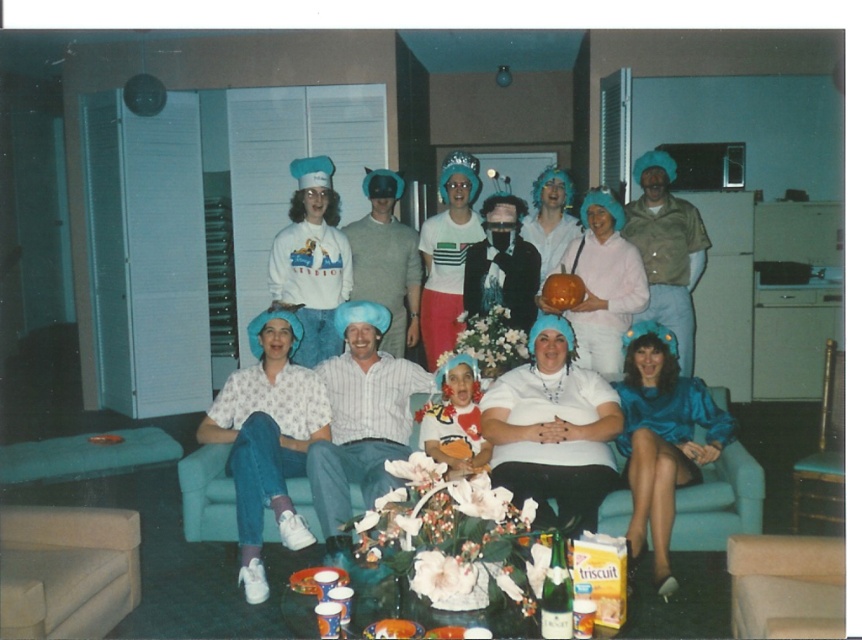
Question: Which of the following is the closest to the observer?

Choices:
 (A) blue satin dress at lower right
 (B) beige fabric couch at lower left
 (C) shiny blue dress at lower right
 (D) matte pink sweater at center

Answer: (B)

Question: Does teal fabric couch at center have a lesser width compared to velvet plush teddy bear at center?

Choices:
 (A) no
 (B) yes

Answer: (A)

Question: Can you confirm if blue satin dress at lower right is positioned to the right of white printed shirt at center?

Choices:
 (A) no
 (B) yes

Answer: (B)

Question: Which point is closer to the camera?

Choices:
 (A) (223, 440)
 (B) (417, 397)

Answer: (A)

Question: Which point is closer to the camera?

Choices:
 (A) white matte shirt at center
 (B) shiny blue dress at lower right

Answer: (A)

Question: Can you confirm if teal fabric couch at center is positioned below white printed shirt at center?

Choices:
 (A) no
 (B) yes

Answer: (B)